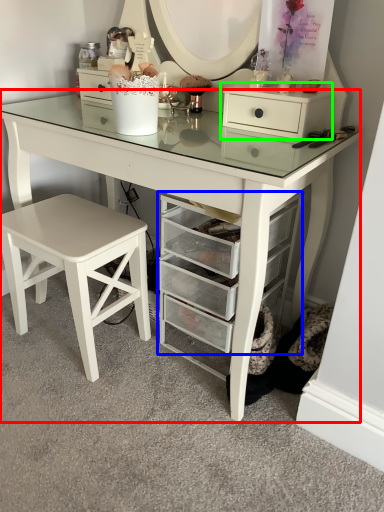
Question: Based on their relative distances, which object is nearer to table (highlighted by a red box)? Choose from shelf (highlighted by a blue box) and chest of drawers (highlighted by a green box).

Choices:
 (A) shelf
 (B) chest of drawers

Answer: (A)